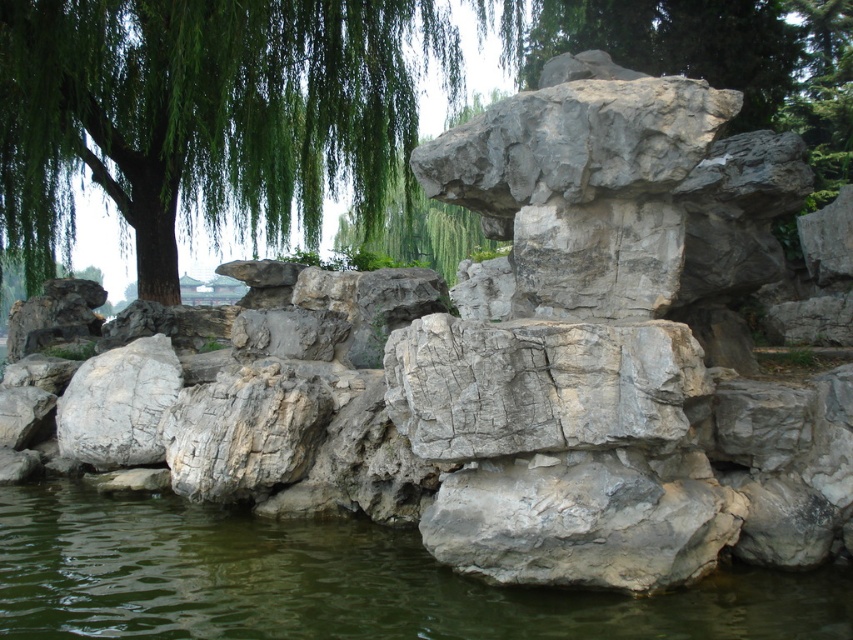
Does green leafy willow at upper left have a lesser height compared to green water at lower center?

Incorrect, green leafy willow at upper left's height does not fall short of green water at lower center's.

Does point (177, 292) lie behind point (22, 518)?

Yes, point (177, 292) is farther from viewer.

Who is more distant from viewer, (x=103, y=180) or (x=680, y=605)?

Positioned behind is point (x=103, y=180).

Identify the location of green leafy willow at upper left. (207, 116).